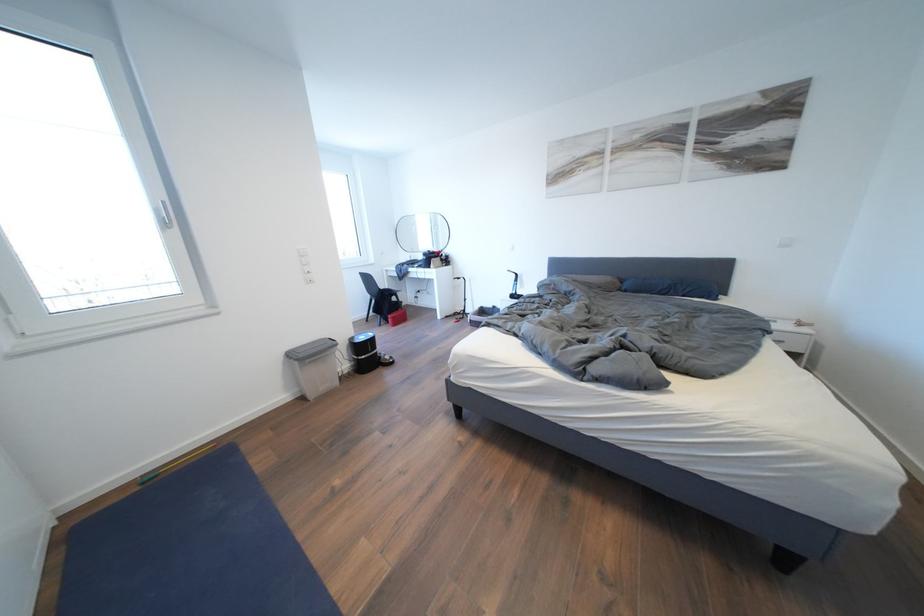
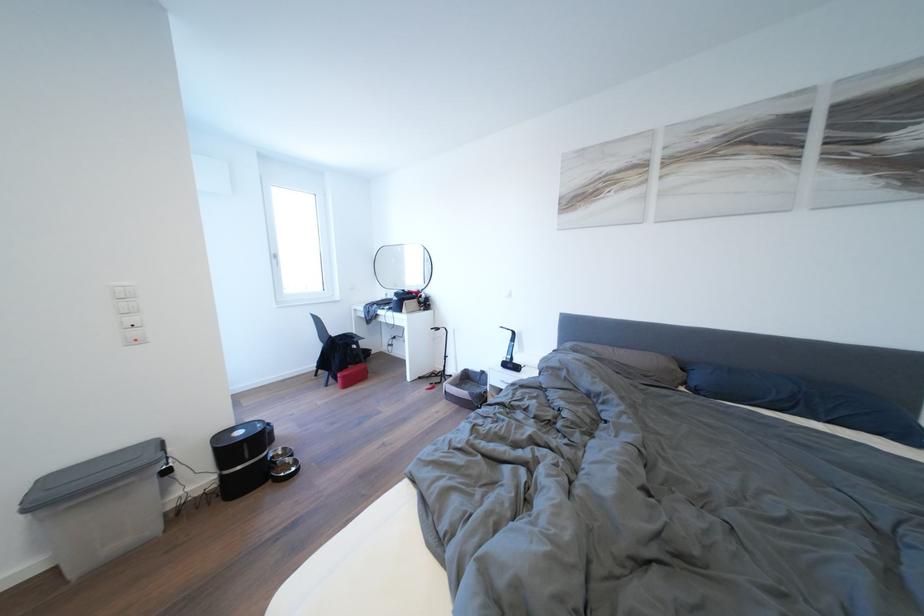
Where in the second image is the point corresponding to point 397,318 from the first image?

(348, 376)